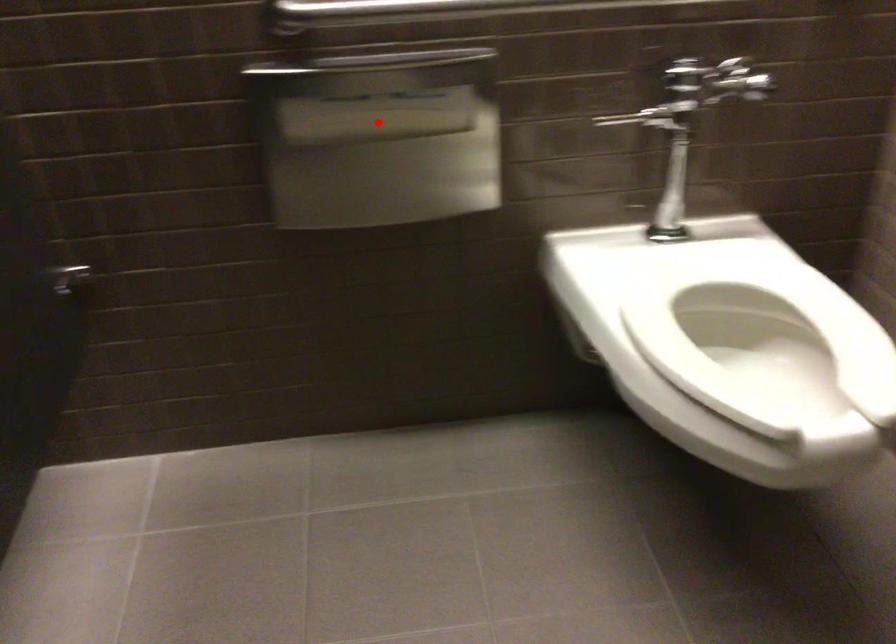
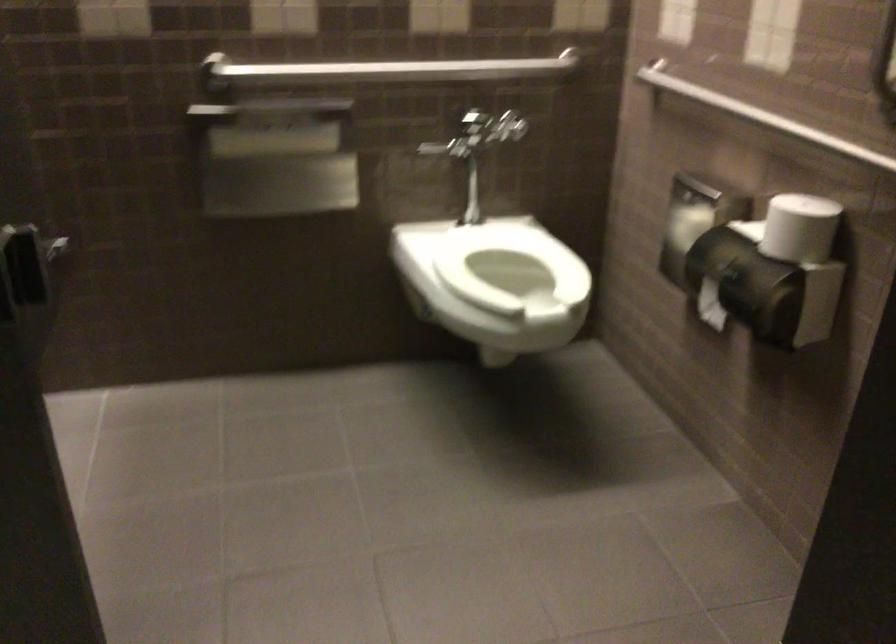
The point at the highlighted location is marked in the first image. Where is the corresponding point in the second image?

(273, 143)